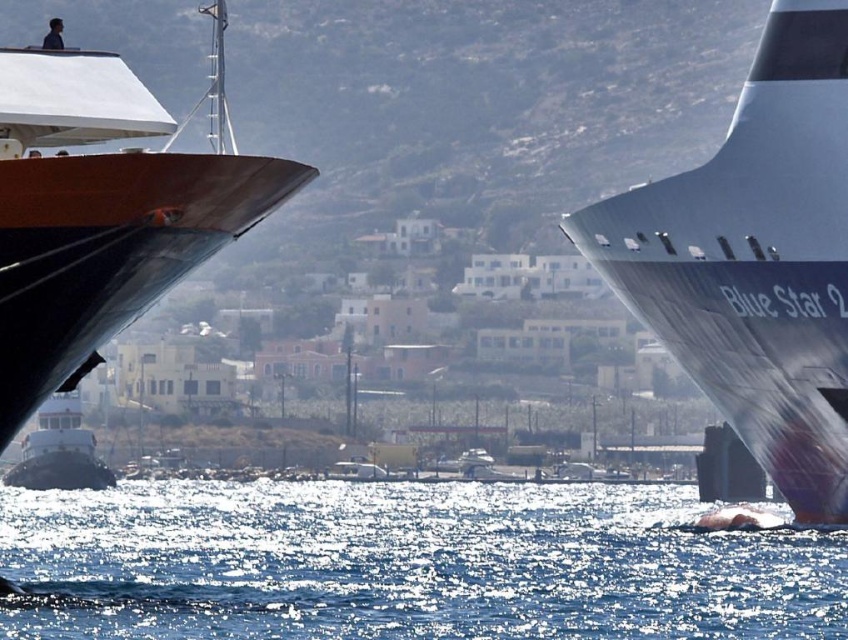
Based on the photo, you are a photographer trying to capture both the shiny brown hull at left and the white glossy tugboat at lower left in a single shot. Based on their heights, which object should you focus on first to ensure both are in the frame?

The shiny brown hull at left has a lesser height compared to the white glossy tugboat at lower left. To ensure both are in the frame, focus on the taller white glossy tugboat at lower left first, then adjust the camera angle to include the shorter shiny brown hull at left.

You are a sailor navigating a small boat between the metallic gray ship at right and the shiny brown hull at left. Based on their positions, which ship should you steer closer to avoid collision with the other?

You should steer closer to the shiny brown hull at left because the metallic gray ship at right is positioned under it, meaning the metallic gray ship is closer to your boat. By moving toward the shiny brown hull at left, which is farther away, you can safely avoid collision with the closer metallic gray ship at right.